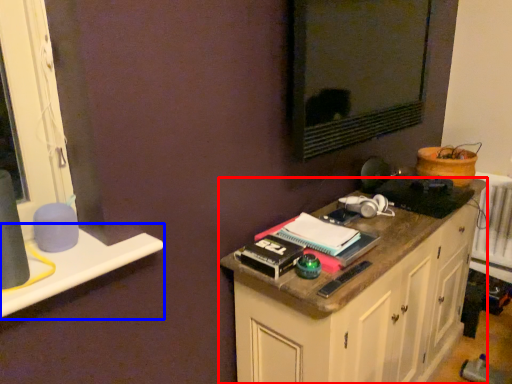
Question: Which point is further to the camera, cabinetry (highlighted by a red box) or window sill (highlighted by a blue box)?

Choices:
 (A) cabinetry
 (B) window sill

Answer: (A)